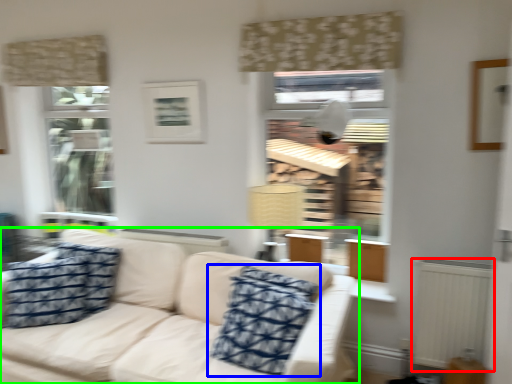
Question: Considering the real-world distances, which object is closest to radiator (highlighted by a red box)? pillow (highlighted by a blue box) or studio couch (highlighted by a green box).

Choices:
 (A) pillow
 (B) studio couch

Answer: (A)